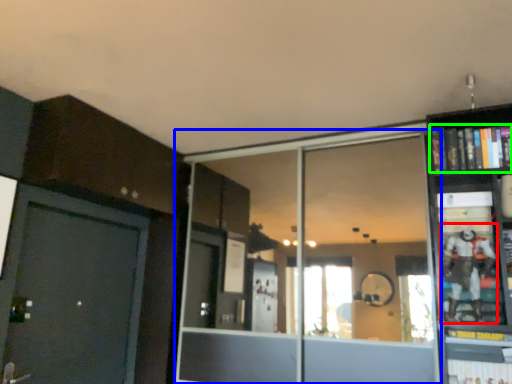
Question: Which object is positioned farthest from toy (highlighted by a red box)? Select from glass door (highlighted by a blue box) and book (highlighted by a green box).

Choices:
 (A) glass door
 (B) book

Answer: (A)